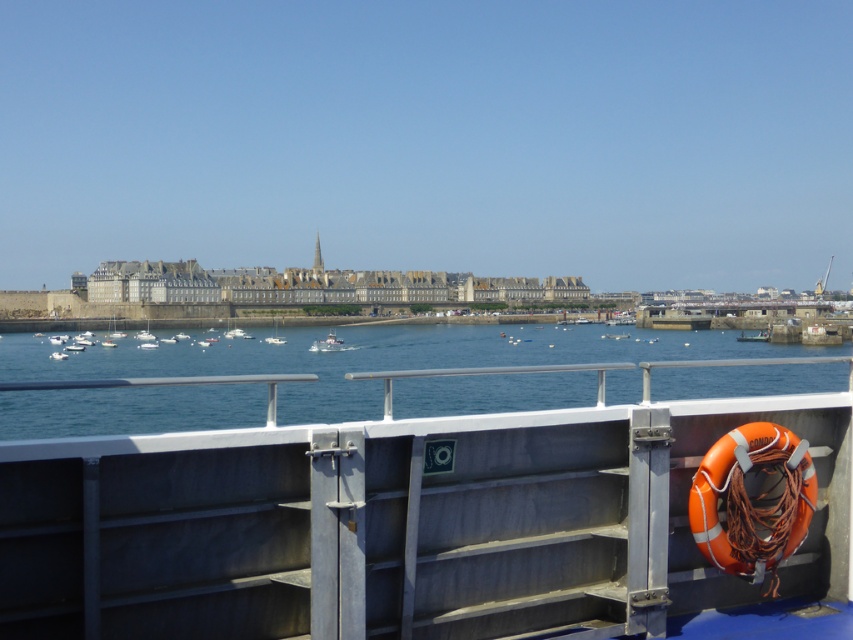
You are a photographer trying to capture the entire scene of the blue water at center and orange rubber life jacket at right in one shot. Based on their sizes, which object will occupy more of the frame?

The blue water at center has a greater width than the orange rubber life jacket at right, so it will occupy more of the frame.

You are standing on the deck of the ferry and want to locate the blue water at center. According to the coordinates given, where would you look relative to the vessel?

The blue water at center is located at coordinates point 0.559 on the x axis and 0.438 on the y axis, so you should look towards the central area of the vessel deck.